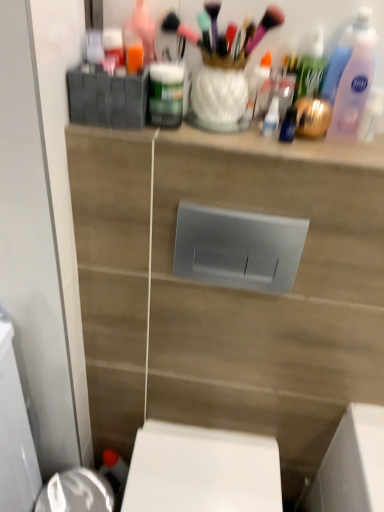
Question: From the image's perspective, relative to pink plastic bottle at upper right, is matte green jar at upper center above or below?

Choices:
 (A) above
 (B) below

Answer: (B)

Question: Is point coord(150,103) positioned closer to the camera than point coord(344,101)?

Choices:
 (A) closer
 (B) farther

Answer: (A)

Question: Which object is the farthest from the matte plastic toiletries at upper center?

Choices:
 (A) pink plastic bottle at upper right
 (B) matte green jar at upper center

Answer: (A)

Question: Which object is the closest to the matte green jar at upper center?

Choices:
 (A) pink plastic bottle at upper right
 (B) matte plastic toiletries at upper center

Answer: (B)